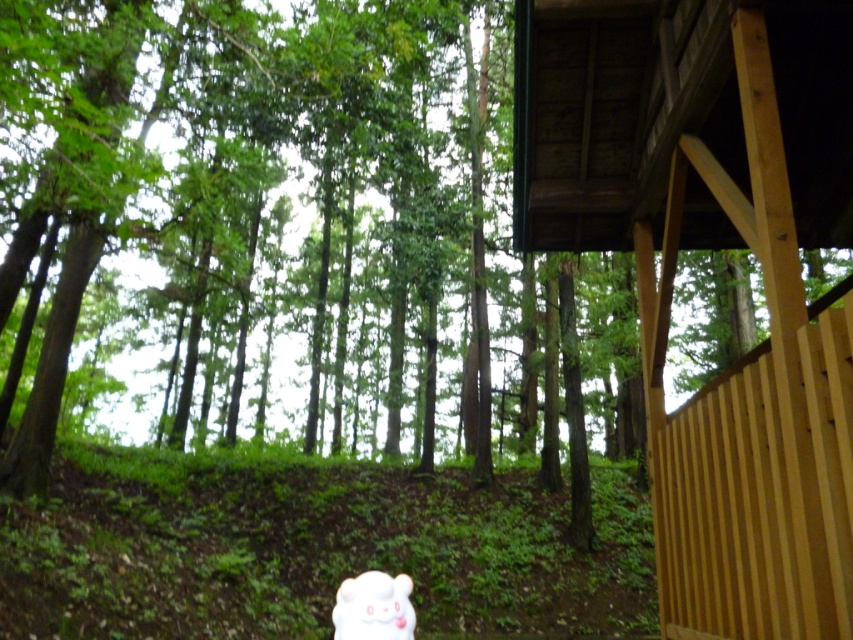
You are standing on the wooden deck and want to place a new bench between the wooden cabin at upper right and the white plush toy at lower center. To ensure the bench is centered between them, which object should you use as your starting reference point?

The wooden cabin at upper right is to the right of the white plush toy at lower center, so to center the bench between them, start by measuring the distance from the white plush toy at lower center to the wooden cabin at upper right and place the bench exactly halfway between both objects.

Consider the image. You are standing on the wooden deck and want to place a new decoration. If you look towards the wooden cabin at upper right and the white plush toy at lower center, which one is positioned higher in the scene?

The wooden cabin at upper right is positioned higher than the white plush toy at lower center.